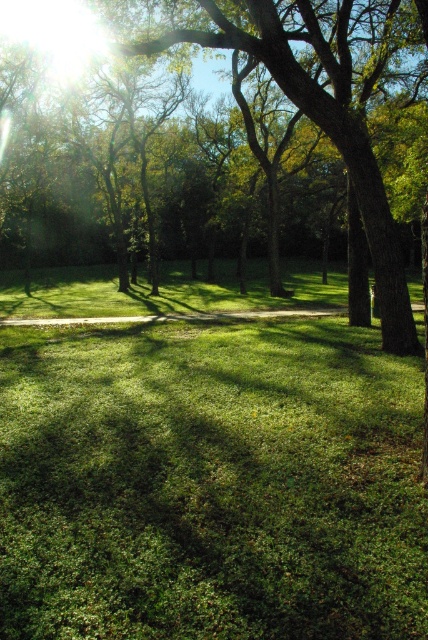
You are standing in the forest and want to move from the point at coordinates point (382,508) to the point at coordinates point (353,1). Which direction should you walk to get closer to your destination?

Point (382,508) is closer to the viewer than point (353,1). To move toward the destination, you should walk away from the viewer since the destination is further away.